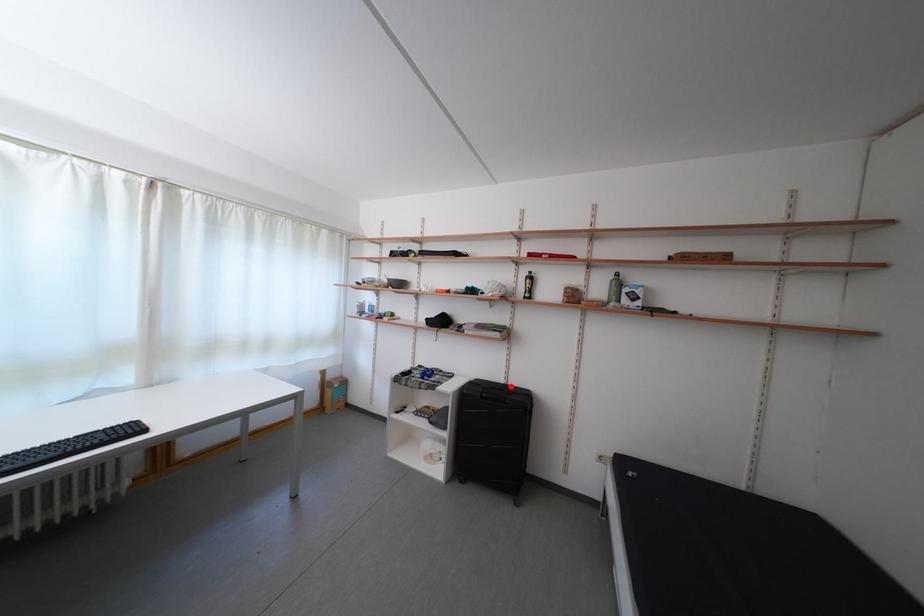
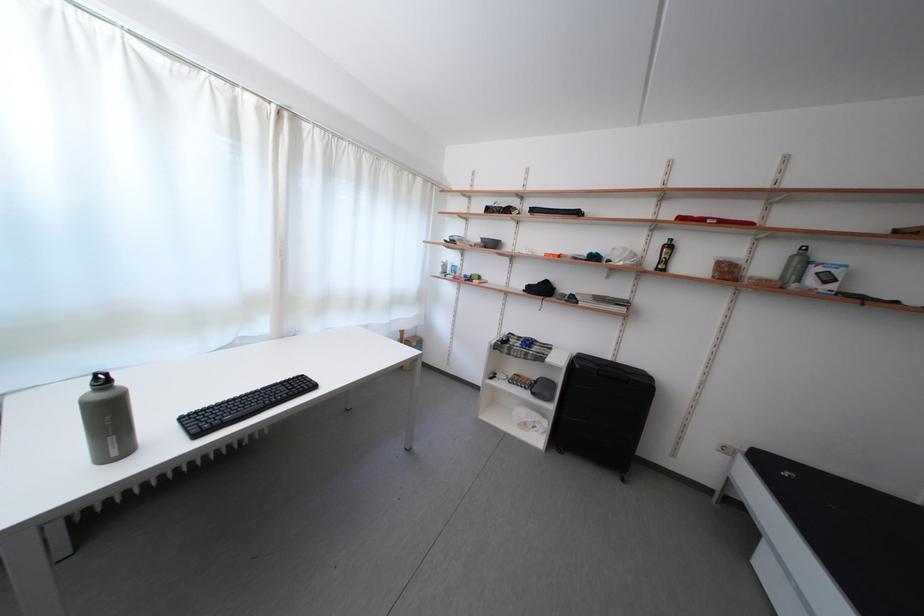
Question: I am providing you with two images of the same scene from different viewpoints. A red point is shown in image1. For the corresponding object point in image2, is it positioned nearer or farther from the camera?

Choices:
 (A) Nearer
 (B) Farther

Answer: (A)